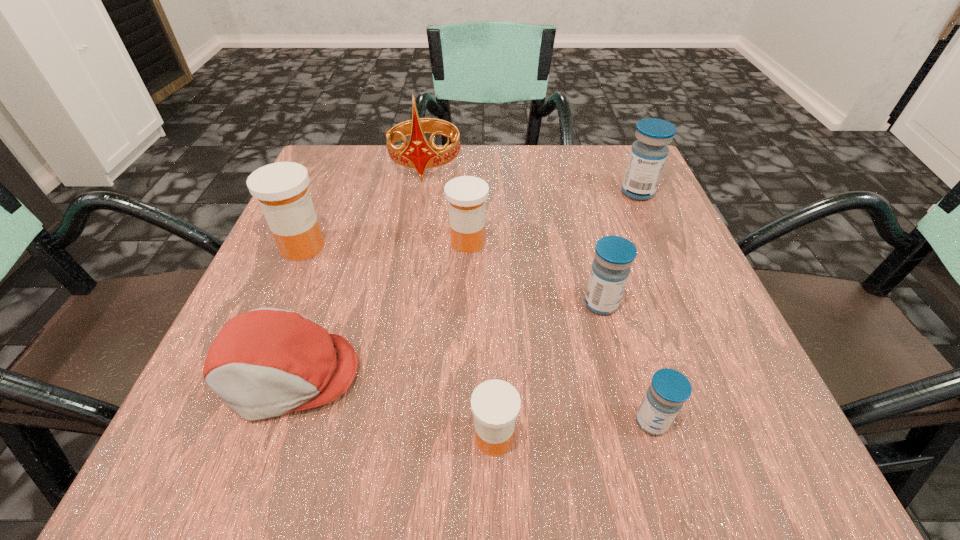
In the image, there is a desktop. Where is `vacant space at the right edge`? This screenshot has height=540, width=960. vacant space at the right edge is located at coordinates (642, 307).

The width and height of the screenshot is (960, 540). Identify the location of vacant space at the far right corner of the desktop. (591, 158).

You are a GUI agent. You are given a task and a screenshot of the screen. Output one action in this format:
    pyautogui.click(x=<x>, y=<y>)
    Task: Click on the free space at the near right corner of the desktop
    The width and height of the screenshot is (960, 540).
    Given the screenshot: What is the action you would take?
    pyautogui.click(x=726, y=454)

What are the coordinates of `free spot between the rightmost blue medicine and the second smallest orange medicine` in the screenshot? It's located at (553, 217).

In order to click on empty space between the rightmost object and the tiara in this screenshot , I will do `click(532, 178)`.

Find the location of `free space between the smallest orange medicine and the biggest blue medicine`. free space between the smallest orange medicine and the biggest blue medicine is located at coordinates (565, 315).

This screenshot has width=960, height=540. Identify the location of empty space that is in between the biggest orange medicine and the red tiara. (364, 205).

This screenshot has height=540, width=960. In order to click on free point between the red cap and the second farthest blue medicine in this screenshot , I will do `click(444, 339)`.

This screenshot has height=540, width=960. In order to click on free space between the smallest blue medicine and the rightmost blue medicine in this screenshot , I will do `click(644, 307)`.

You are a GUI agent. You are given a task and a screenshot of the screen. Output one action in this format:
    pyautogui.click(x=<x>, y=<y>)
    Task: Click on the vacant area between the biggest blue medicine and the red cap
    
    Given the screenshot: What is the action you would take?
    pyautogui.click(x=463, y=283)